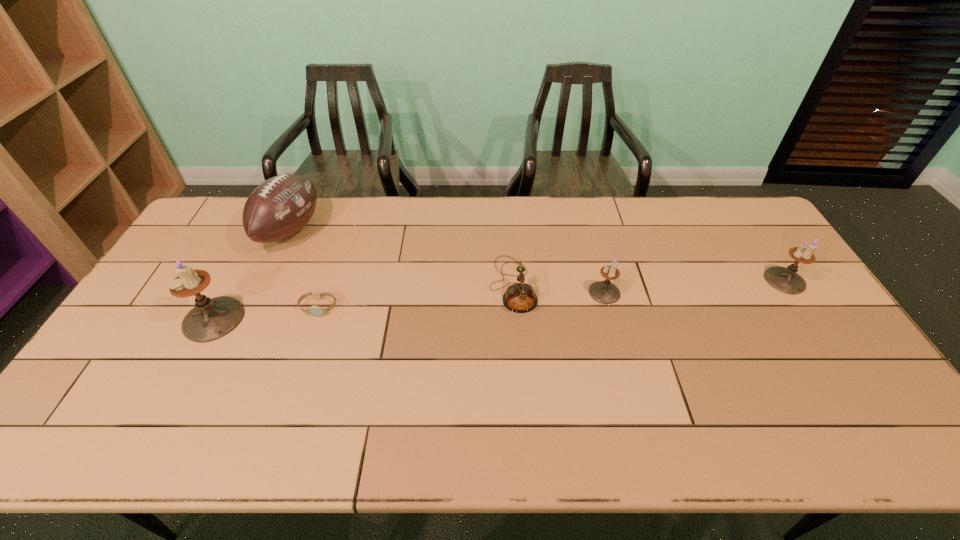
Find the location of a particular element. This screenshot has width=960, height=540. object that is at the left edge is located at coordinates (210, 319).

The image size is (960, 540). Identify the location of object located in the right edge section of the desktop. (786, 280).

This screenshot has width=960, height=540. Identify the location of vacant space at the far edge of the desktop. (459, 197).

Find the location of a particular element. This screenshot has height=540, width=960. blank space at the near edge of the desktop is located at coordinates (452, 403).

In the image, there is a desktop. Identify the location of vacant space at the right edge. The image size is (960, 540). (758, 298).

Where is `empty location between the rightmost object and the third object from left to right`? empty location between the rightmost object and the third object from left to right is located at coordinates (552, 294).

At what (x,y) coordinates should I click in order to perform the action: click on free spot between the football (American) and the leftmost candle holder. Please return your answer as a coordinate pair (x, y). This screenshot has width=960, height=540. Looking at the image, I should click on (252, 274).

Image resolution: width=960 pixels, height=540 pixels. I want to click on vacant space in between the fourth object from right to left and the leftmost candle holder, so pyautogui.click(x=266, y=313).

Where is `free space between the second candle holder from right to left and the fourth object from right to left`? Image resolution: width=960 pixels, height=540 pixels. free space between the second candle holder from right to left and the fourth object from right to left is located at coordinates (462, 300).

You are a GUI agent. You are given a task and a screenshot of the screen. Output one action in this format:
    pyautogui.click(x=<x>, y=<y>)
    Task: Click on the unoccupied area between the fifth tallest object and the tallest object
    The width and height of the screenshot is (960, 540).
    Given the screenshot: What is the action you would take?
    pyautogui.click(x=363, y=302)